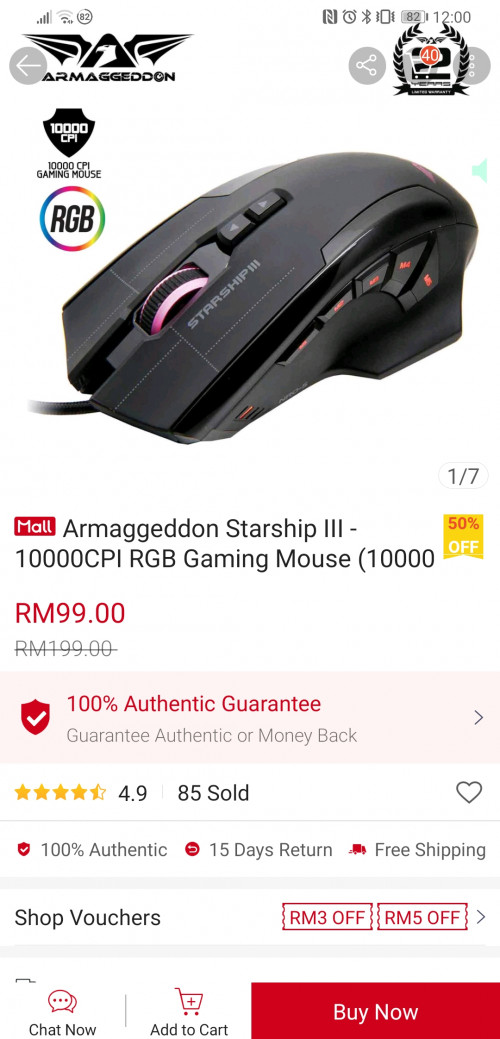
Find the location of `photo of gaming mouse`. photo of gaming mouse is located at coordinates (288, 254).